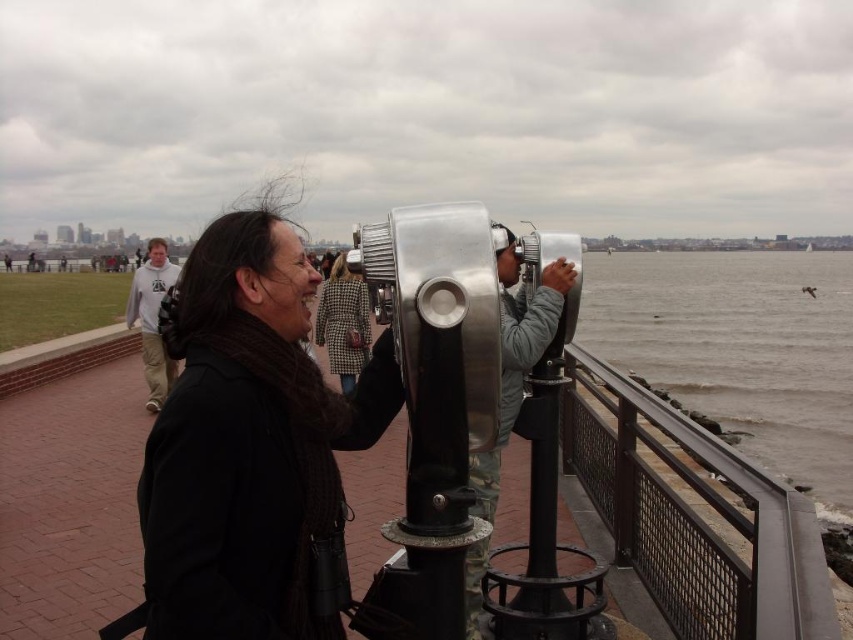
Which is in front, point (207, 266) or point (339, 349)?

Positioned in front is point (207, 266).

Can you confirm if black wool scarf at center is positioned to the right of houndstooth fabric coat at center?

Indeed, black wool scarf at center is positioned on the right side of houndstooth fabric coat at center.

Identify the location of black wool scarf at center. (242, 448).

Can you confirm if houndstooth fabric coat at center is smaller than light gray hoodie at center?

Incorrect, houndstooth fabric coat at center is not smaller in size than light gray hoodie at center.

Describe the element at coordinates (343, 323) in the screenshot. I see `houndstooth fabric coat at center` at that location.

Find the location of a particular element. houndstooth fabric coat at center is located at coordinates (343, 323).

Does black wool scarf at center have a larger size compared to light gray hoodie at center?

Correct, black wool scarf at center is larger in size than light gray hoodie at center.

Measure the distance between black wool scarf at center and light gray hoodie at center.

black wool scarf at center is 50.59 feet from light gray hoodie at center.

Locate an element on the screen. Image resolution: width=853 pixels, height=640 pixels. black wool scarf at center is located at coordinates (242, 448).